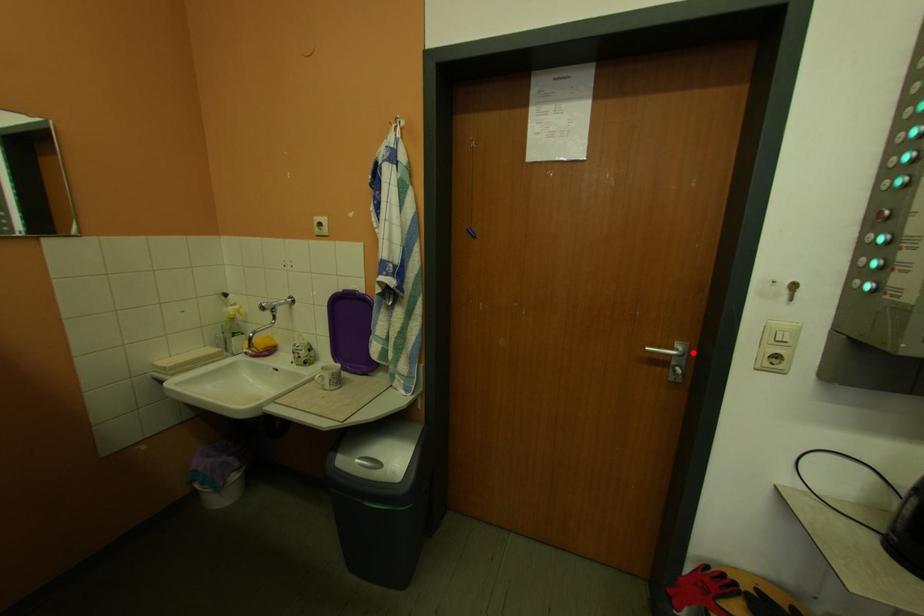
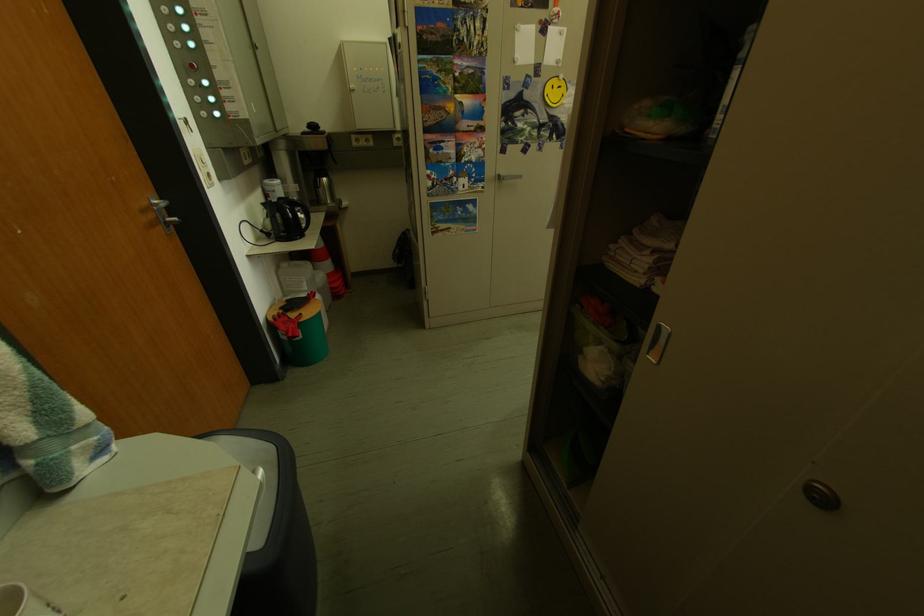
Locate, in the second image, the point that corresponds to the highlighted location in the first image.

(168, 205)